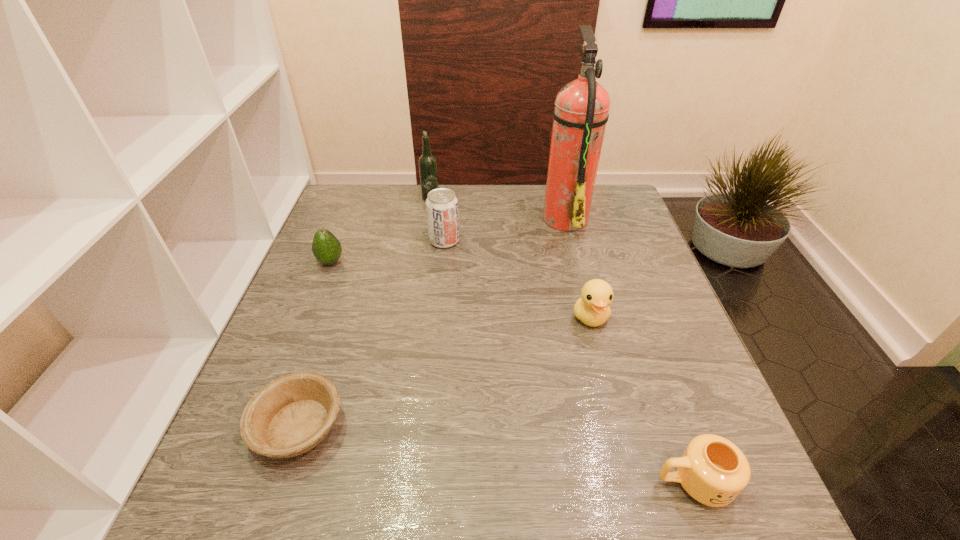
Find the location of a particular element. This screenshot has height=540, width=960. fire extinguisher is located at coordinates (581, 112).

Where is `beer bottle`? Image resolution: width=960 pixels, height=540 pixels. beer bottle is located at coordinates (427, 162).

Identify the location of the third tallest object. This screenshot has height=540, width=960. (441, 204).

Locate an element on the screen. The height and width of the screenshot is (540, 960). duck is located at coordinates (592, 308).

Where is `avocado`? This screenshot has width=960, height=540. avocado is located at coordinates (326, 248).

Where is `mug`? The image size is (960, 540). mug is located at coordinates (713, 470).

The width and height of the screenshot is (960, 540). I want to click on bowl, so click(x=291, y=415).

Find the location of a particular element. The height and width of the screenshot is (540, 960). vacant space situated at the nozzle of the tallest object is located at coordinates (478, 217).

Locate an element on the screen. vacant space located 0.210m at the nozzle of the tallest object is located at coordinates (471, 217).

This screenshot has width=960, height=540. In order to click on vacant space located at the nozzle of the tallest object in this screenshot , I will do `click(427, 217)`.